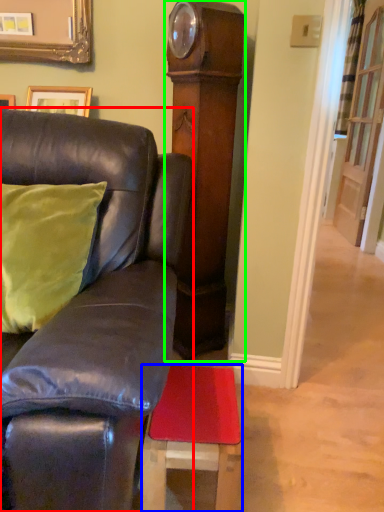
Question: Which object is positioned closest to furniture (highlighted by a red box)? Select from stool (highlighted by a blue box) and side (highlighted by a green box).

Choices:
 (A) stool
 (B) side

Answer: (A)